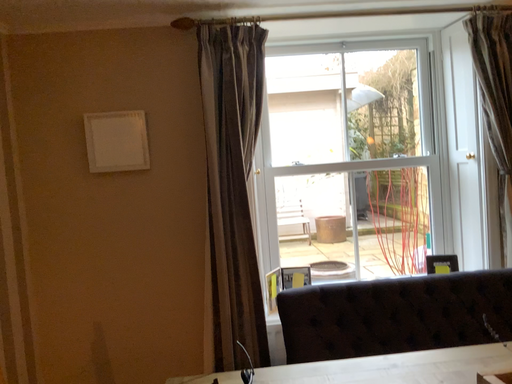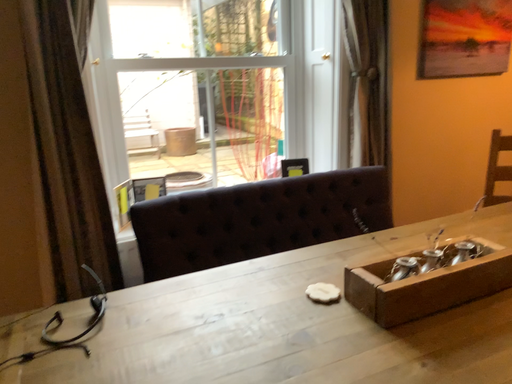
Question: Which way did the camera rotate in the video?

Choices:
 (A) rotated upward
 (B) rotated downward

Answer: (B)